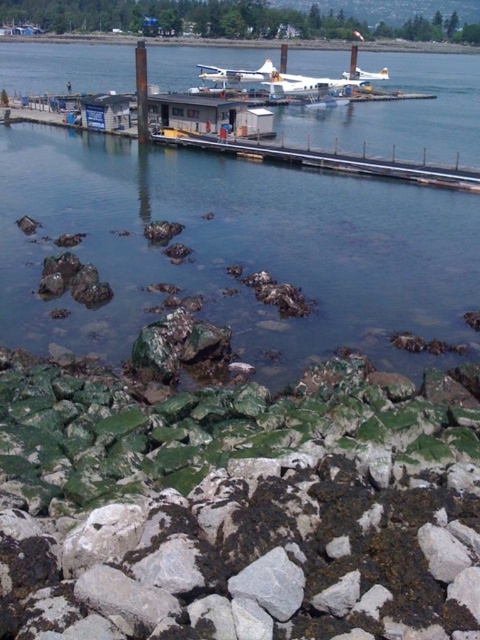
Does white matte seaplane at upper center have a larger size compared to white matte airplane at upper center?

Yes.

Does point (237, 76) come closer to viewer compared to point (384, 68)?

Yes, point (237, 76) is closer to viewer.

Identify the location of white matte seaplane at upper center. This screenshot has height=640, width=480. (237, 72).

Between point (304, 157) and point (266, 64), which one is positioned behind?

The point (266, 64) is more distant.

Which is above, smooth concrete pier at upper center or white matte seaplane at upper center?

white matte seaplane at upper center is higher up.

Locate an element on the screen. smooth concrete pier at upper center is located at coordinates (324, 160).

Where is `smooth concrete pier at upper center`? This screenshot has width=480, height=640. smooth concrete pier at upper center is located at coordinates (324, 160).

Can you confirm if smooth concrete pier at upper center is positioned to the left of white matte airplane at upper center?

Indeed, smooth concrete pier at upper center is positioned on the left side of white matte airplane at upper center.

Does smooth concrete pier at upper center appear over white matte airplane at upper center?

Incorrect, smooth concrete pier at upper center is not positioned above white matte airplane at upper center.

Is point (425, 172) behind point (370, 76)?

That is False.

I want to click on smooth concrete pier at upper center, so click(x=324, y=160).